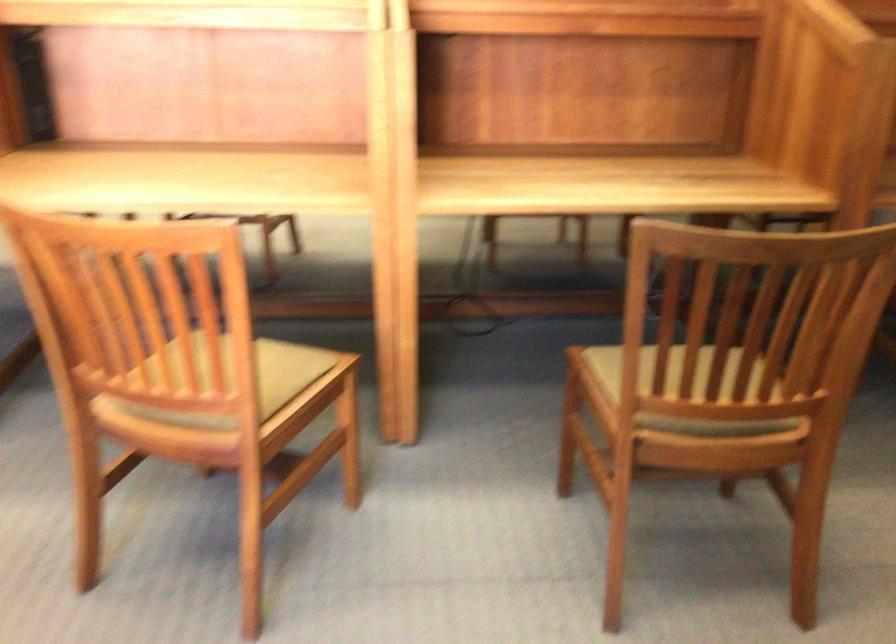
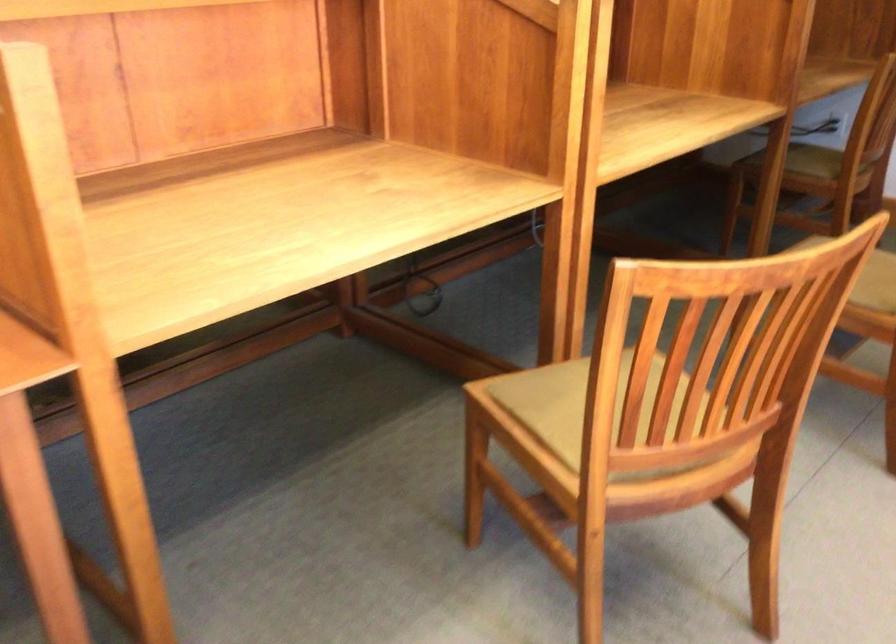
Locate, in the second image, the point that corresponds to (640,388) in the first image.

(869, 275)